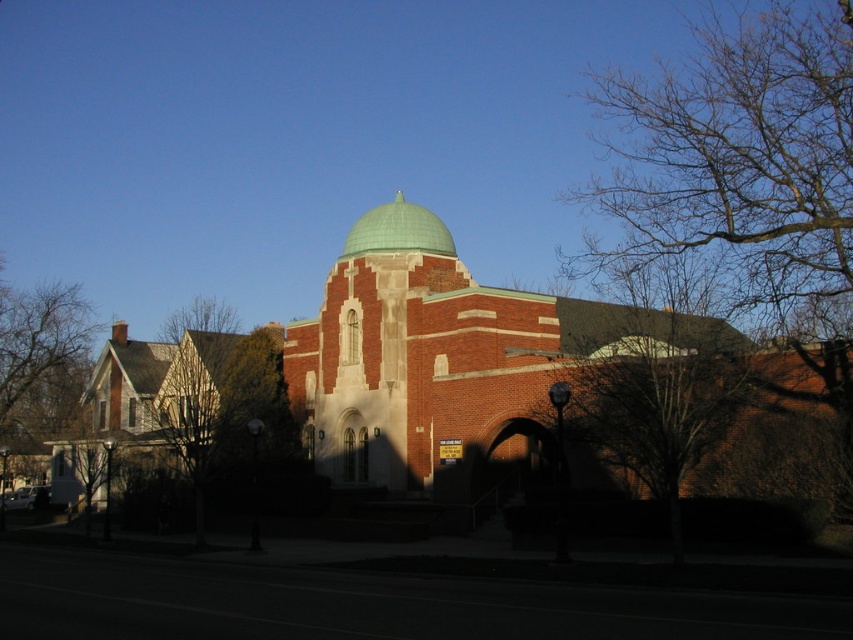
Does bare branches at upper right come in front of green metallic dome at center?

Yes, it is.

From the picture: Between bare branches at upper right and green metallic dome at center, which one appears on the right side from the viewer's perspective?

From the viewer's perspective, bare branches at upper right appears more on the right side.

Which is in front, point (747, 289) or point (383, 225)?

Point (747, 289)

Locate an element on the screen. This screenshot has height=640, width=853. bare branches at upper right is located at coordinates [746, 186].

Where is `brown wood tree at left`? This screenshot has height=640, width=853. brown wood tree at left is located at coordinates (41, 360).

Based on the photo, is bare branches at upper right thinner than brown wood tree at left?

Correct, bare branches at upper right's width is less than brown wood tree at left's.

Can you confirm if bare branches at upper right is positioned above brown wood tree at left?

Yes.

Who is more distant from viewer, (795, 38) or (57, 422)?

The point (57, 422) is behind.

The width and height of the screenshot is (853, 640). Find the location of `bare branches at upper right`. bare branches at upper right is located at coordinates (746, 186).